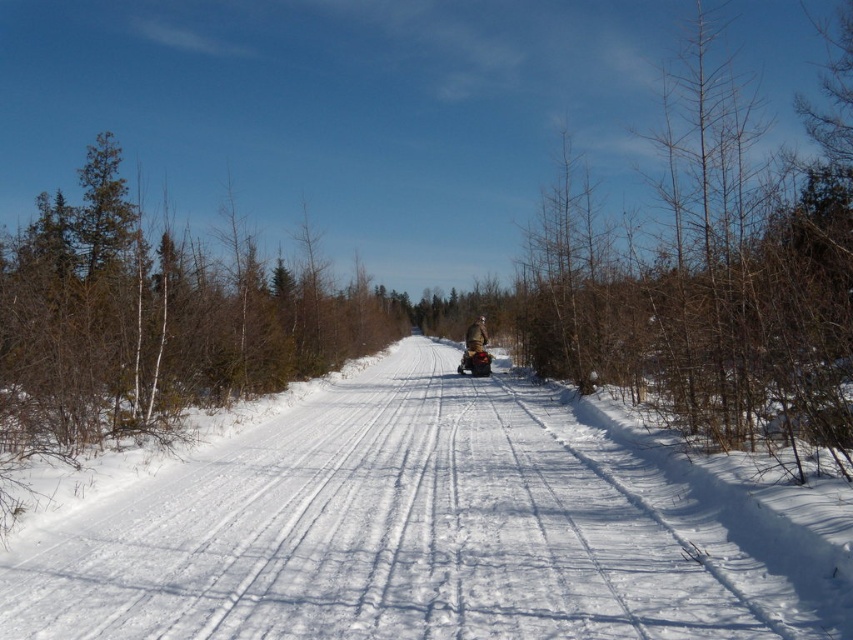
In the scene shown: Does white snow trail at center have a smaller size compared to matte black snowmobile at center?

Actually, white snow trail at center might be larger than matte black snowmobile at center.

Between point (462, 520) and point (474, 364), which one is positioned in front?

Point (462, 520) is in front.

Find the location of a particular element. The image size is (853, 640). white snow trail at center is located at coordinates (409, 532).

You are a GUI agent. You are given a task and a screenshot of the screen. Output one action in this format:
    pyautogui.click(x=<x>, y=<y>)
    Task: Click on the white snow trail at center
    The image size is (853, 640).
    Given the screenshot: What is the action you would take?
    pyautogui.click(x=409, y=532)

Does matte black snowmobile at center appear on the right side of brown fuzzy jacket at center?

No, matte black snowmobile at center is not to the right of brown fuzzy jacket at center.

Is point (480, 346) farther from camera compared to point (486, 342)?

No.

What do you see at coordinates (474, 358) in the screenshot?
I see `matte black snowmobile at center` at bounding box center [474, 358].

You are a GUI agent. You are given a task and a screenshot of the screen. Output one action in this format:
    pyautogui.click(x=<x>, y=<y>)
    Task: Click on the matte black snowmobile at center
    The height and width of the screenshot is (640, 853).
    Given the screenshot: What is the action you would take?
    pyautogui.click(x=474, y=358)

Which is in front, point (459, 476) or point (670, 404)?

Point (459, 476) is in front.

Is white snow trail at center closer to the viewer compared to bare branches at right?

Yes, white snow trail at center is in front of bare branches at right.

Is point (659, 496) closer to viewer compared to point (546, 316)?

Yes, it is.

Find the location of `white snow trail at center`. white snow trail at center is located at coordinates (409, 532).